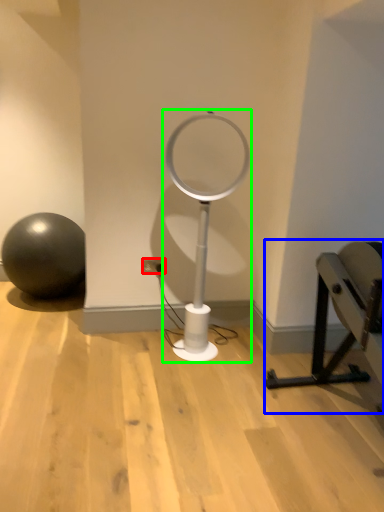
Question: Considering the real-world distances, which object is closest to electric outlet (highlighted by a red box)? furniture (highlighted by a blue box) or table lamp (highlighted by a green box).

Choices:
 (A) furniture
 (B) table lamp

Answer: (B)